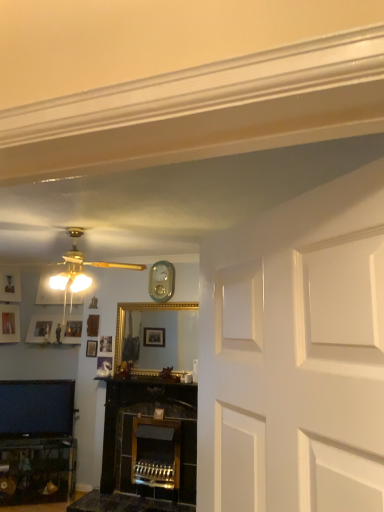
Question: Is the position of matte silver picture frame at left, placed as the 1th picture frame when sorted from left to right, more distant than that of matte black tv at lower left?

Choices:
 (A) no
 (B) yes

Answer: (B)

Question: Considering the relative positions of matte silver picture frame at left, placed as the 1th picture frame when sorted from left to right, and matte black tv at lower left in the image provided, is matte silver picture frame at left, placed as the 1th picture frame when sorted from left to right, to the right of matte black tv at lower left from the viewer's perspective?

Choices:
 (A) yes
 (B) no

Answer: (B)

Question: Can you confirm if matte silver picture frame at left, arranged as the second picture frame when viewed from the back, is wider than matte black tv at lower left?

Choices:
 (A) yes
 (B) no

Answer: (B)

Question: Is the position of matte silver picture frame at left, the 2th picture frame when ordered from front to back, less distant than that of matte black tv at lower left?

Choices:
 (A) no
 (B) yes

Answer: (A)

Question: From a real-world perspective, relative to teal glossy clock at upper center, is matte silver picture frame at left, the 3th picture frame positioned from the right, vertically above or below?

Choices:
 (A) below
 (B) above

Answer: (A)

Question: Considering the positions of matte silver picture frame at left, arranged as the second picture frame when viewed from the back, and teal glossy clock at upper center in the image, is matte silver picture frame at left, arranged as the second picture frame when viewed from the back, bigger or smaller than teal glossy clock at upper center?

Choices:
 (A) big
 (B) small

Answer: (A)

Question: Would you say matte silver picture frame at left, placed as the 1th picture frame when sorted from left to right, is to the left or to the right of teal glossy clock at upper center in the picture?

Choices:
 (A) right
 (B) left

Answer: (B)

Question: Looking at their shapes, would you say matte silver picture frame at left, the 2th picture frame when ordered from front to back, is wider or thinner than teal glossy clock at upper center?

Choices:
 (A) wide
 (B) thin

Answer: (A)

Question: Visually, is matte black tv at lower left positioned to the left or to the right of wooden picture frame at upper left, which appears as the first picture frame when viewed from the right?

Choices:
 (A) left
 (B) right

Answer: (A)

Question: Considering the positions of matte black tv at lower left and wooden picture frame at upper left, the 3th picture frame viewed from the back, in the image, is matte black tv at lower left bigger or smaller than wooden picture frame at upper left, the 3th picture frame viewed from the back,?

Choices:
 (A) small
 (B) big

Answer: (B)

Question: Is matte black tv at lower left in front of or behind wooden picture frame at upper left, marked as the third picture frame in a left-to-right arrangement, in the image?

Choices:
 (A) behind
 (B) front

Answer: (B)

Question: Choose the correct answer: Is matte black tv at lower left inside wooden picture frame at upper left, the 3th picture frame viewed from the back, or outside it?

Choices:
 (A) outside
 (B) inside

Answer: (A)

Question: From the image's perspective, is matte silver picture frame at left, the 2th picture frame when ordered from front to back, above or below matte black tv at lower left?

Choices:
 (A) below
 (B) above

Answer: (B)

Question: In the image, is matte silver picture frame at left, the 3th picture frame positioned from the right, positioned in front of or behind matte black tv at lower left?

Choices:
 (A) behind
 (B) front

Answer: (A)